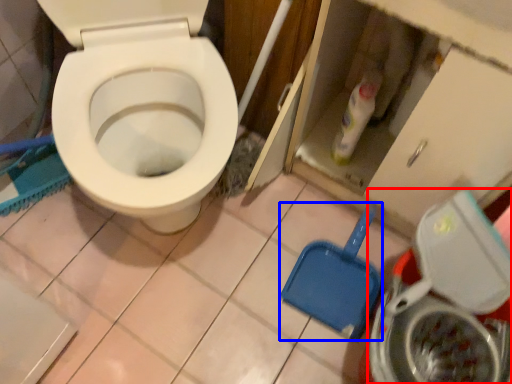
Question: Which of the following is the farthest to the observer, washing machine (highlighted by a red box) or shovel (highlighted by a blue box)?

Choices:
 (A) washing machine
 (B) shovel

Answer: (B)